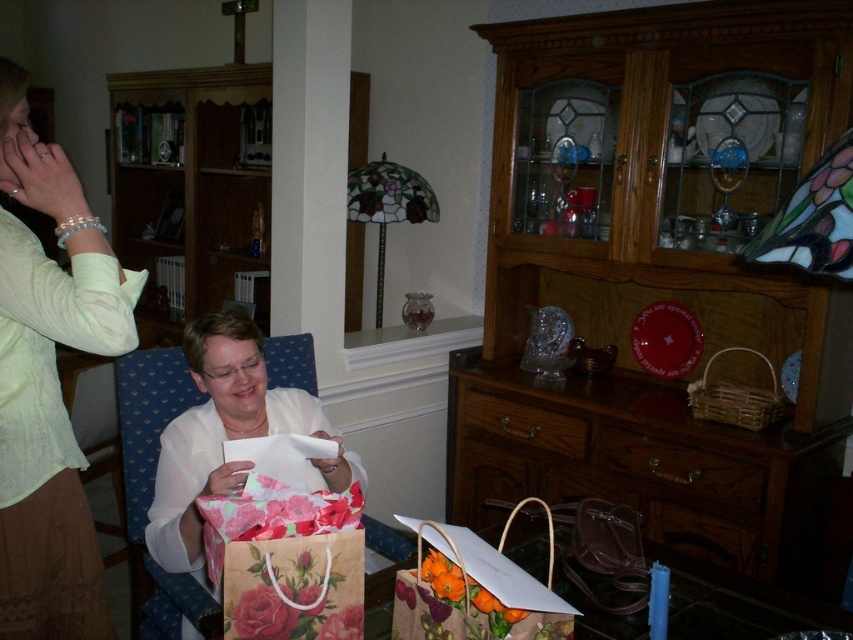
Question: Which point appears closest to the camera in this image?

Choices:
 (A) click(256, 412)
 (B) click(61, 413)

Answer: (B)

Question: Is light green fabric shirt at upper left positioned in front of floral paper bag at center?

Choices:
 (A) no
 (B) yes

Answer: (B)

Question: Does light green fabric shirt at upper left appear under floral paper bag at center?

Choices:
 (A) no
 (B) yes

Answer: (A)

Question: Among these objects, which one is farthest from the camera?

Choices:
 (A) floral paper bag at center
 (B) light green fabric shirt at upper left

Answer: (A)

Question: Does light green fabric shirt at upper left have a larger size compared to floral paper bag at center?

Choices:
 (A) yes
 (B) no

Answer: (B)